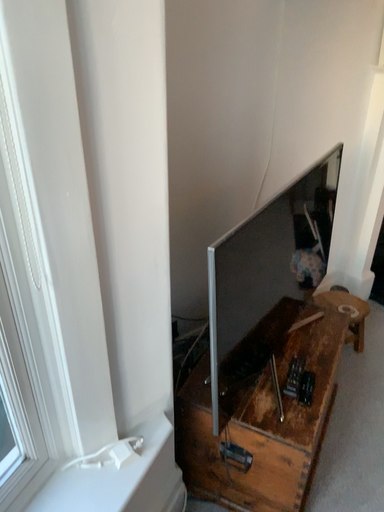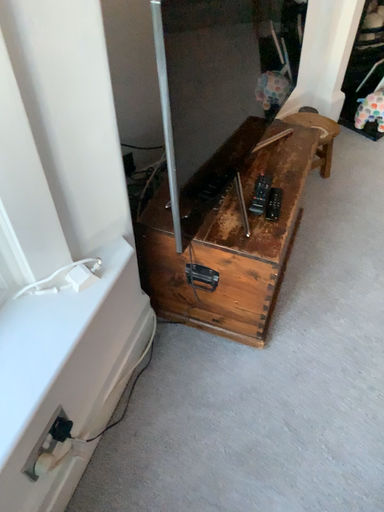
Question: How did the camera likely rotate when shooting the video?

Choices:
 (A) rotated upward
 (B) rotated downward

Answer: (B)